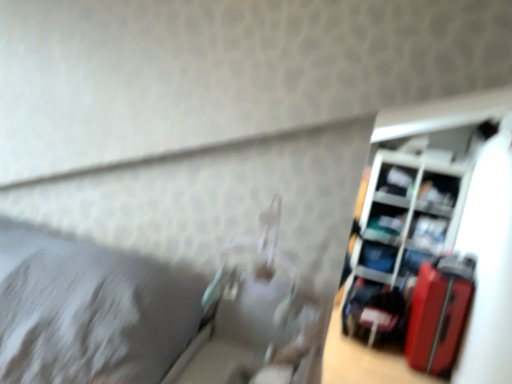
Question: Considering the relative sizes of matte plastic shelf at upper right, placed as the 3th shelf when sorted from top to bottom, and matte black laptop at right, the 5th shelf in the top-to-bottom sequence, in the image provided, is matte plastic shelf at upper right, placed as the 3th shelf when sorted from top to bottom, bigger than matte black laptop at right, the 5th shelf in the top-to-bottom sequence,?

Choices:
 (A) yes
 (B) no

Answer: (A)

Question: Does matte plastic shelf at upper right, the third shelf from the bottom, appear on the right side of matte black laptop at right, the 5th shelf in the top-to-bottom sequence?

Choices:
 (A) yes
 (B) no

Answer: (A)

Question: From a real-world perspective, is matte plastic shelf at upper right, the third shelf from the bottom, over matte black laptop at right, which is the 1th shelf in bottom-to-top order?

Choices:
 (A) no
 (B) yes

Answer: (B)

Question: Is the position of matte plastic shelf at upper right, the third shelf from the bottom, less distant than that of matte black laptop at right, which is the 1th shelf in bottom-to-top order?

Choices:
 (A) no
 (B) yes

Answer: (B)

Question: Is matte plastic shelf at upper right, placed as the 3th shelf when sorted from top to bottom, facing away from matte black laptop at right, the 5th shelf in the top-to-bottom sequence?

Choices:
 (A) yes
 (B) no

Answer: (B)

Question: Is point (417, 276) positioned closer to the camera than point (403, 188)?

Choices:
 (A) closer
 (B) farther

Answer: (A)

Question: Is shiny red suitcase at right in front of or behind black plastic shelf at upper right, the 5th shelf ordered from the bottom, in the image?

Choices:
 (A) front
 (B) behind

Answer: (A)

Question: Choose the correct answer: Is shiny red suitcase at right inside black plastic shelf at upper right, which ranks as the 1th shelf in top-to-bottom order, or outside it?

Choices:
 (A) outside
 (B) inside

Answer: (A)

Question: From a real-world perspective, is shiny red suitcase at right positioned above or below black plastic shelf at upper right, which ranks as the 1th shelf in top-to-bottom order?

Choices:
 (A) below
 (B) above

Answer: (A)

Question: Considering the positions of matte plastic shelf at upper right, placed as the 3th shelf when sorted from top to bottom, and matte black laptop at right, which is the 1th shelf in bottom-to-top order, in the image, is matte plastic shelf at upper right, placed as the 3th shelf when sorted from top to bottom, taller or shorter than matte black laptop at right, which is the 1th shelf in bottom-to-top order,?

Choices:
 (A) tall
 (B) short

Answer: (A)

Question: Choose the correct answer: Is matte plastic shelf at upper right, the third shelf from the bottom, inside matte black laptop at right, which is the 1th shelf in bottom-to-top order, or outside it?

Choices:
 (A) inside
 (B) outside

Answer: (B)

Question: From a real-world perspective, is matte plastic shelf at upper right, placed as the 3th shelf when sorted from top to bottom, positioned above or below matte black laptop at right, which is the 1th shelf in bottom-to-top order?

Choices:
 (A) below
 (B) above

Answer: (B)

Question: Looking at their shapes, would you say matte plastic shelf at upper right, the third shelf from the bottom, is wider or thinner than matte black laptop at right, the 5th shelf in the top-to-bottom sequence?

Choices:
 (A) thin
 (B) wide

Answer: (B)

Question: Is matte plastic shelf at right, the second shelf from the bottom, taller or shorter than shiny red suitcase at right?

Choices:
 (A) short
 (B) tall

Answer: (B)

Question: From the image's perspective, relative to shiny red suitcase at right, is matte plastic shelf at right, the second shelf from the bottom, above or below?

Choices:
 (A) below
 (B) above

Answer: (B)